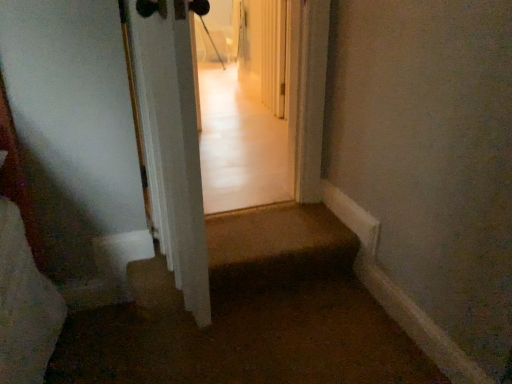
Question: Are brown carpet at lower center and white glossy door at center beside each other?

Choices:
 (A) yes
 (B) no

Answer: (B)

Question: From the image's perspective, is brown carpet at lower center beneath white glossy door at center?

Choices:
 (A) no
 (B) yes

Answer: (B)

Question: From the image's perspective, would you say brown carpet at lower center is positioned over white glossy door at center?

Choices:
 (A) no
 (B) yes

Answer: (A)

Question: Is brown carpet at lower center positioned with its back to white glossy door at center?

Choices:
 (A) no
 (B) yes

Answer: (A)

Question: Is brown carpet at lower center positioned beyond the bounds of white glossy door at center?

Choices:
 (A) yes
 (B) no

Answer: (A)

Question: Does brown carpet at lower center have a greater height compared to white glossy door at center?

Choices:
 (A) no
 (B) yes

Answer: (A)

Question: Is the depth of white glossy door at center less than that of brown carpet at lower center?

Choices:
 (A) no
 (B) yes

Answer: (B)

Question: Is white glossy door at center in contact with brown carpet at lower center?

Choices:
 (A) yes
 (B) no

Answer: (B)

Question: Does white glossy door at center have a greater width compared to brown carpet at lower center?

Choices:
 (A) no
 (B) yes

Answer: (A)

Question: Can you confirm if white glossy door at center is positioned to the left of brown carpet at lower center?

Choices:
 (A) no
 (B) yes

Answer: (B)

Question: Can you confirm if white glossy door at center is thinner than brown carpet at lower center?

Choices:
 (A) no
 (B) yes

Answer: (B)

Question: Considering the relative positions of white glossy door at center and brown carpet at lower center in the image provided, is white glossy door at center behind brown carpet at lower center?

Choices:
 (A) no
 (B) yes

Answer: (A)

Question: Does point [130, 266] appear closer or farther from the camera than point [169, 155]?

Choices:
 (A) closer
 (B) farther

Answer: (B)